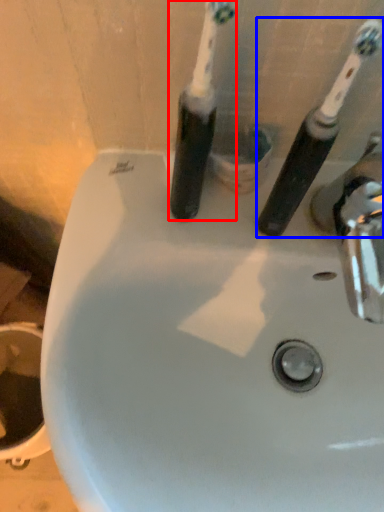
Question: Which point is further to the camera, toothbrush (highlighted by a red box) or toothbrush (highlighted by a blue box)?

Choices:
 (A) toothbrush
 (B) toothbrush

Answer: (B)